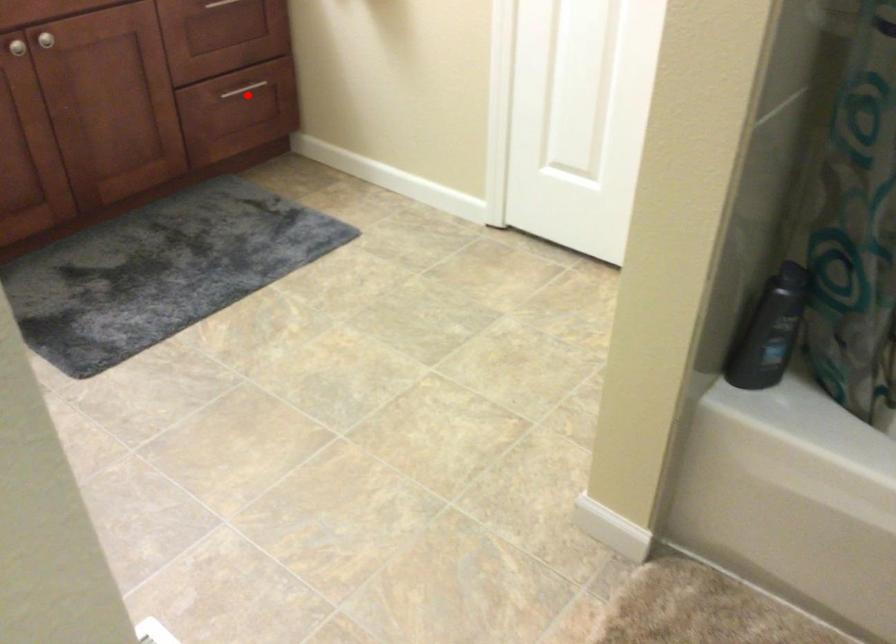
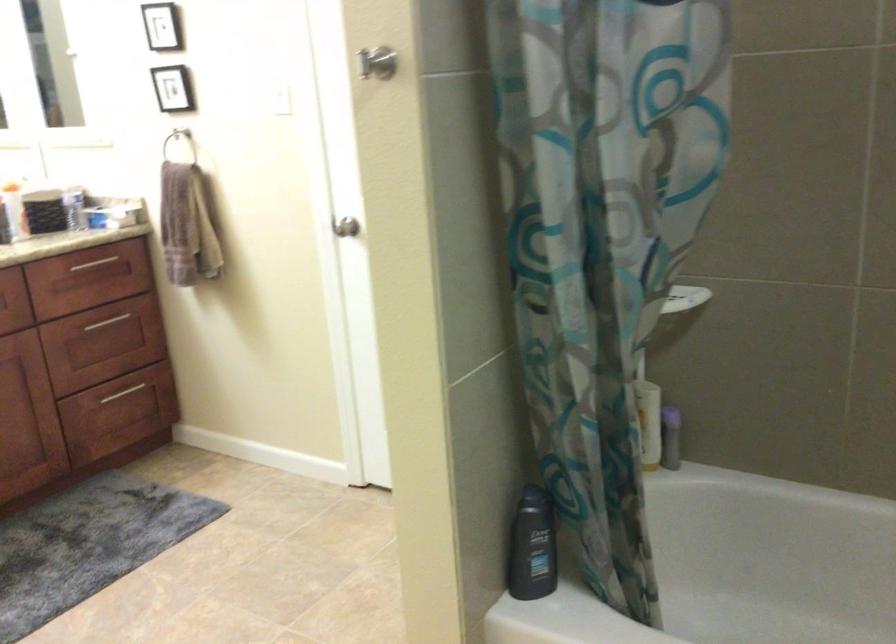
In the second image, find the point that corresponds to the highlighted location in the first image.

(122, 393)